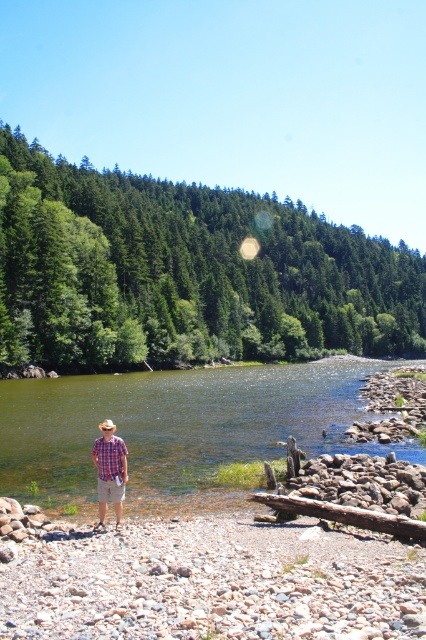
Does green smooth water at center have a lesser height compared to plaid cotton shirt at center?

No.

Who is lower down, green smooth water at center or plaid cotton shirt at center?

green smooth water at center is lower down.

Which is in front, point (43, 390) or point (118, 516)?

Point (118, 516) is in front.

At what (x,y) coordinates should I click in order to perform the action: click on green smooth water at center. Please return your answer as a coordinate pair (x, y). Looking at the image, I should click on click(178, 429).